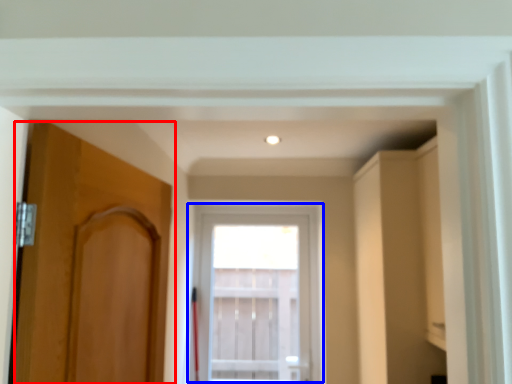
Question: Which point is further to the camera, door (highlighted by a red box) or window (highlighted by a blue box)?

Choices:
 (A) door
 (B) window

Answer: (B)